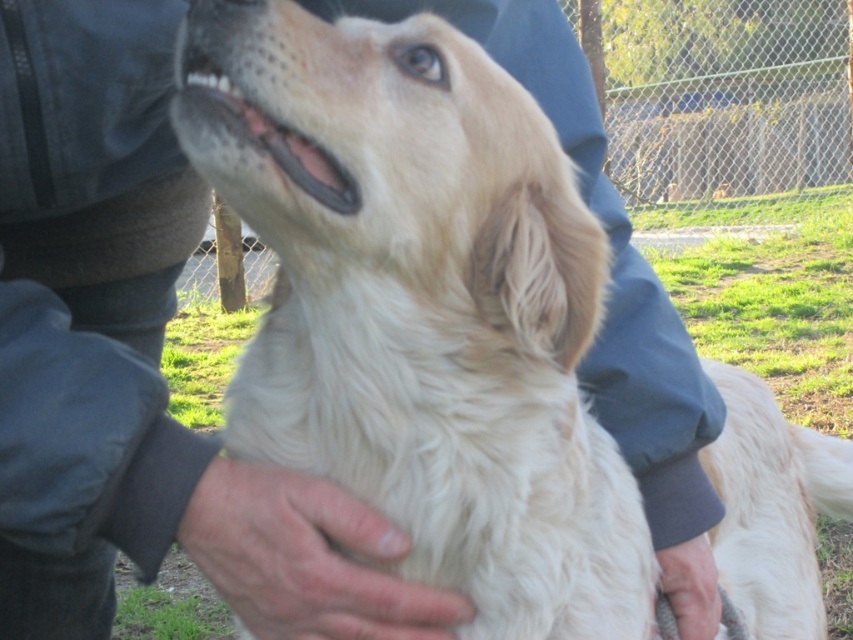
Question: Which point appears closest to the camera in this image?

Choices:
 (A) (300, 513)
 (B) (672, 595)

Answer: (A)

Question: Is fuzzy skin at center to the right of smooth skin hand at lower center from the viewer's perspective?

Choices:
 (A) no
 (B) yes

Answer: (A)

Question: Does fuzzy skin at center have a smaller size compared to smooth skin hand at lower center?

Choices:
 (A) yes
 (B) no

Answer: (B)

Question: Which point is closer to the camera?

Choices:
 (A) (699, 627)
 (B) (450, 637)

Answer: (B)

Question: Does fuzzy skin at center appear under smooth skin hand at lower center?

Choices:
 (A) yes
 (B) no

Answer: (B)